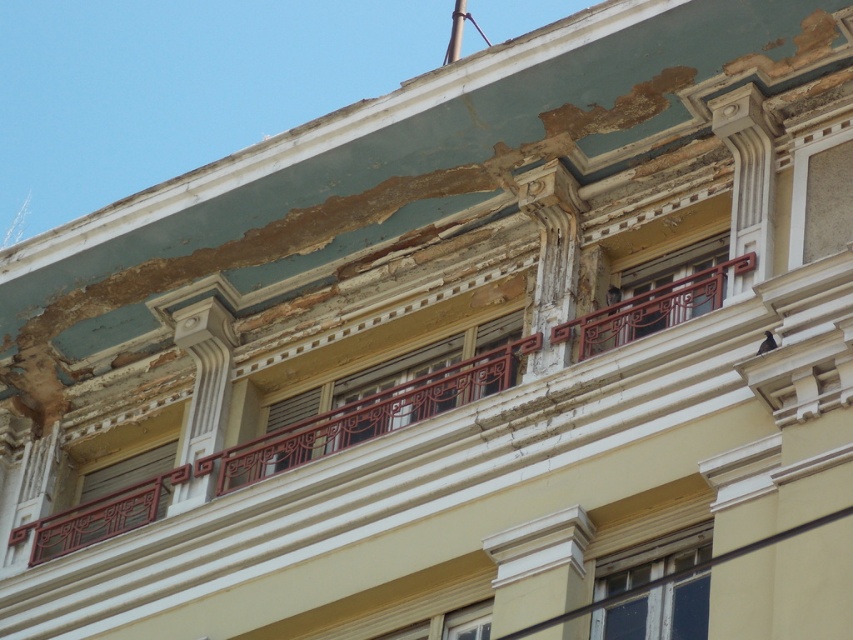
You are an architect assessing the building facade. You need to install a new security camera. The camera requires a mounting space that can accommodate an object of the same size as the wooden lattice window at center. Is the matte red railing at lower left suitable for this purpose?

The wooden lattice window at center has a smaller size compared to the matte red railing at lower left. Since the camera requires a space the size of the window, the matte red railing at lower left is larger and can accommodate the camera.

You are an architect inspecting the building facade. You need to determine if the wooden frame window at center can be covered by a protective sheet that is the same height as the matte red railing at lower left. Can it be fully covered?

The wooden frame window at center is taller than the matte red railing at lower left, so the protective sheet matching the railing height would not be sufficient to fully cover the window.

From the picture: You are standing in front of the building and want to locate the wooden frame window at center. What are its coordinates?

The wooden frame window at center is located at coordinates point (659, 612).